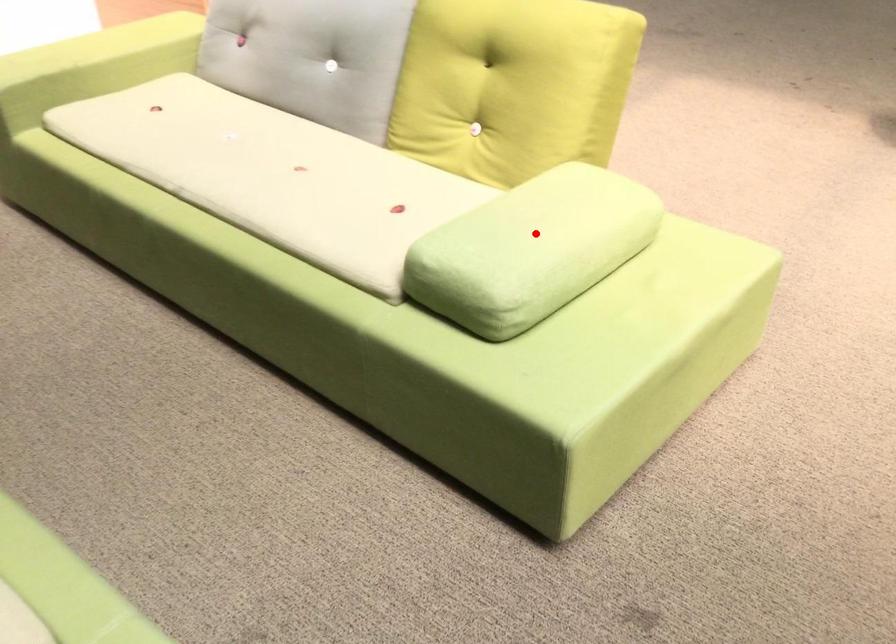
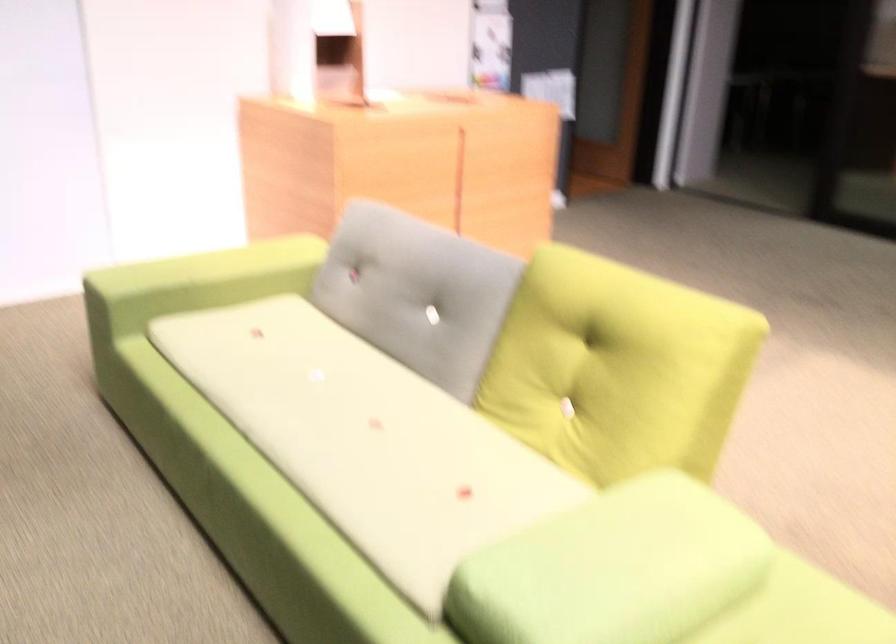
Where in the second image is the point corresponding to the highlighted location from the first image?

(613, 569)